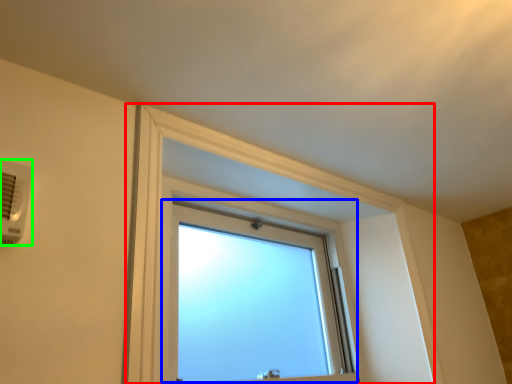
Question: Estimate the real-world distances between objects in this image. Which object is closer to bay window (highlighted by a red box), window (highlighted by a blue box) or air conditioning (highlighted by a green box)?

Choices:
 (A) window
 (B) air conditioning

Answer: (A)